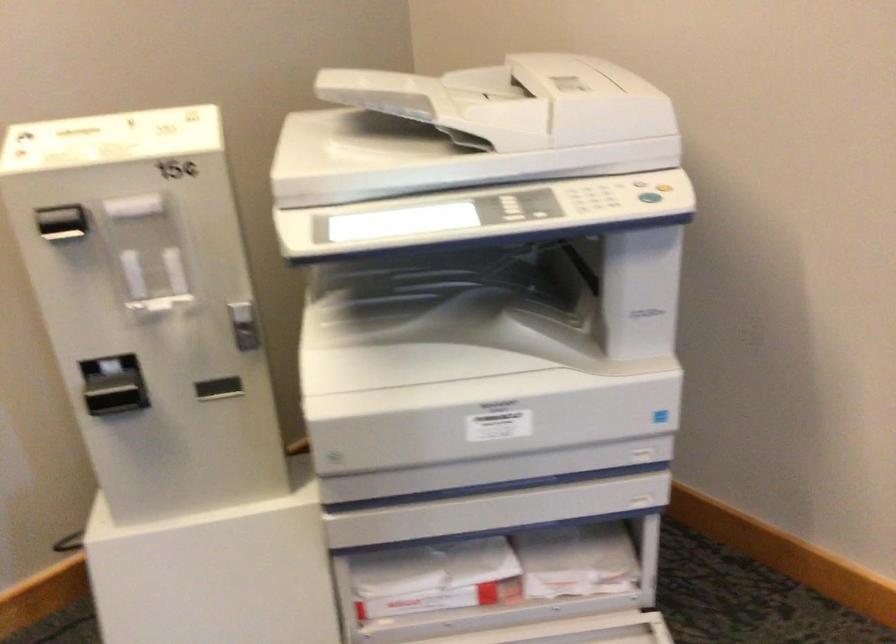
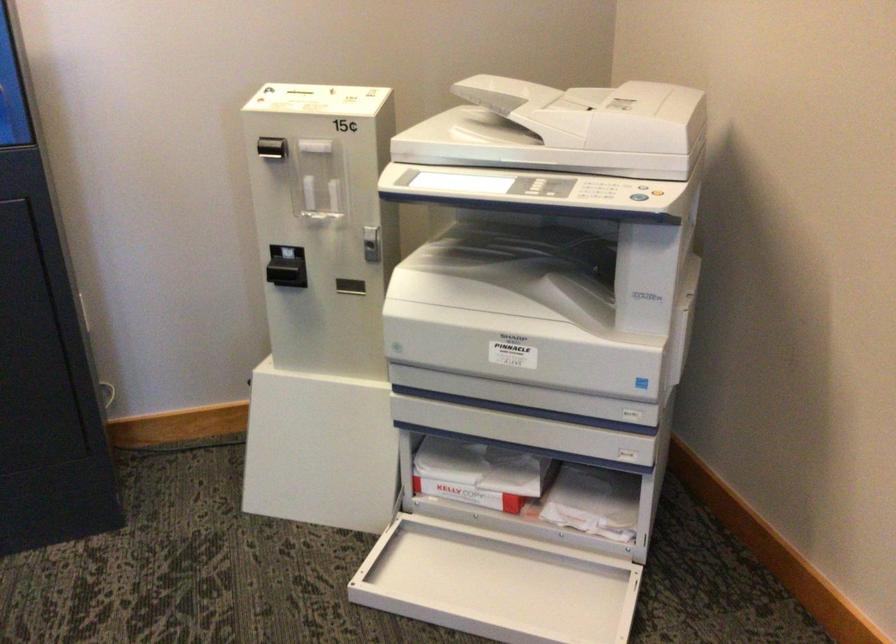
The point at [668,415] is marked in the first image. Where is the corresponding point in the second image?

(643, 384)